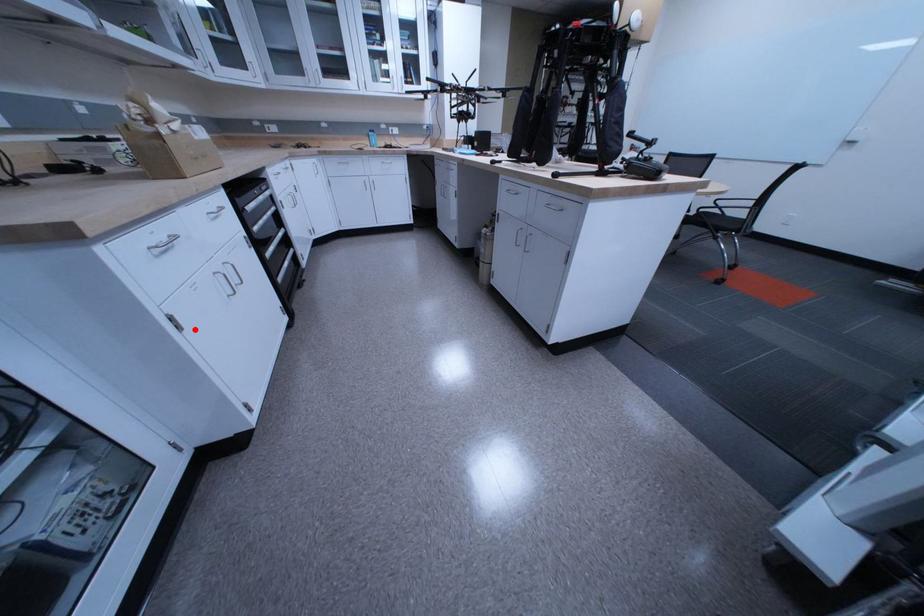
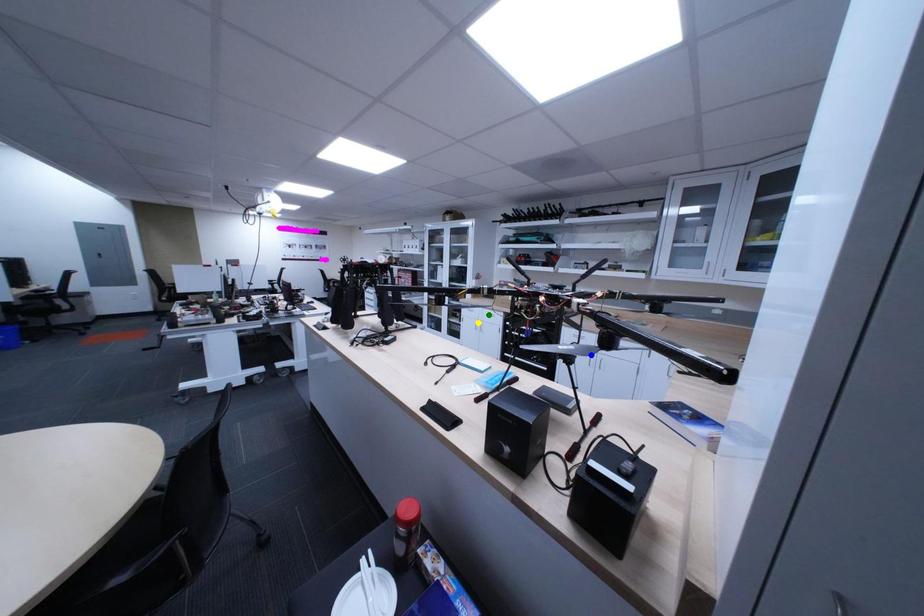
Question: I am providing you with two images of the same scene from different viewpoints. A red point is marked on the first image. You are given multiple points on the second image. Which point in image 2 is actually the same real-world point as the red point in image 1?

Choices:
 (A) yellow point
 (B) green point
 (C) blue point

Answer: (A)